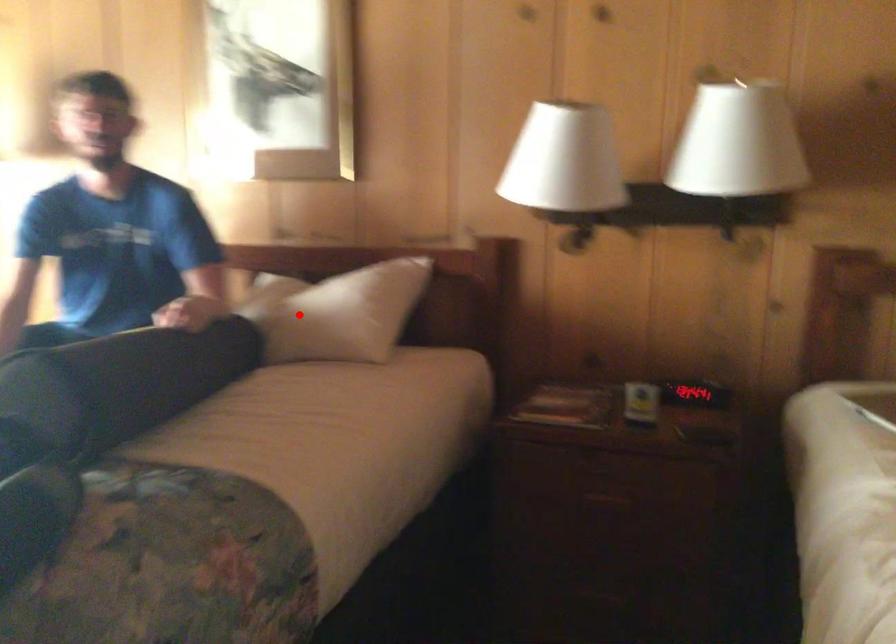
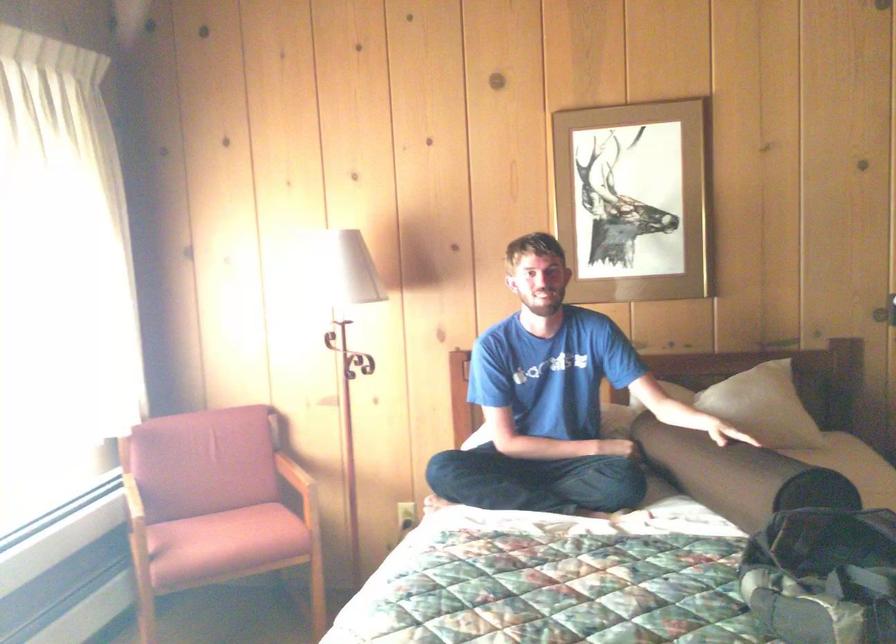
Locate, in the second image, the point that corresponds to the highlighted location in the first image.

(762, 406)